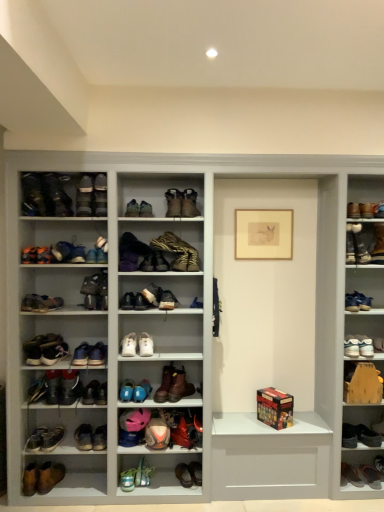
Find the location of `free point in front of brown leather boot at lower right, marked as the 8th footwear in a right-to-left arrangement`. free point in front of brown leather boot at lower right, marked as the 8th footwear in a right-to-left arrangement is located at coordinates click(x=362, y=495).